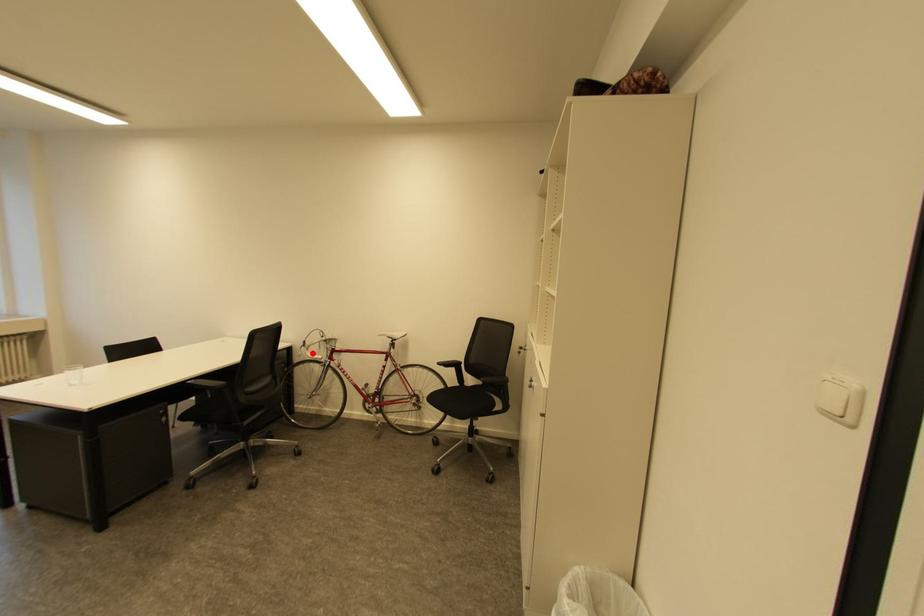
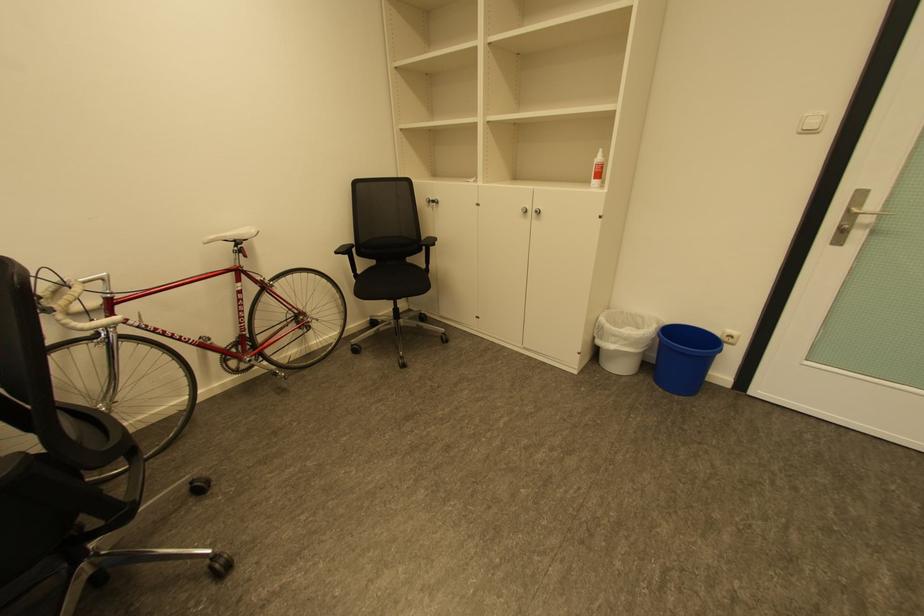
Question: I am providing you with two images of the same scene from different viewpoints. Image1 has a red point marked. In image2, the corresponding 3D location appears at what relative position? Reply with the corresponding letter.

Choices:
 (A) Closer
 (B) Farther

Answer: (A)